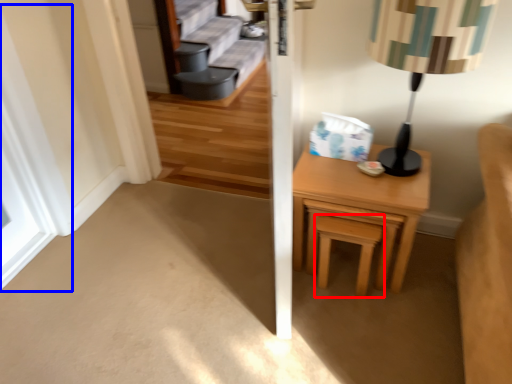
Question: Among these objects, which one is nearest to the camera, stool (highlighted by a red box) or window (highlighted by a blue box)?

Choices:
 (A) stool
 (B) window

Answer: (B)